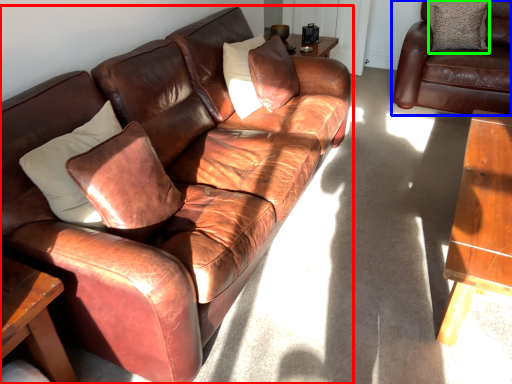
Question: Considering the real-world distances, which object is closest to studio couch (highlighted by a red box)? studio couch (highlighted by a blue box) or pillow (highlighted by a green box).

Choices:
 (A) studio couch
 (B) pillow

Answer: (A)